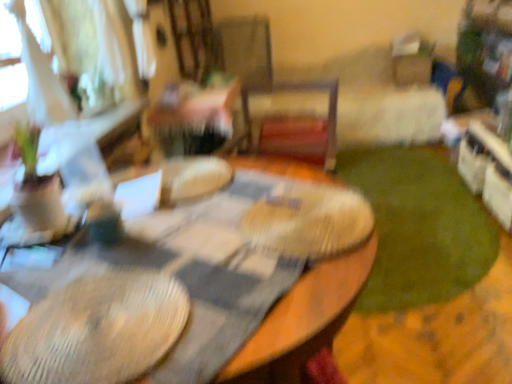
Locate an element on the screen. Image resolution: width=512 pixels, height=384 pixels. free spot below green plush carpet at lower right (from a real-world perspective) is located at coordinates (419, 215).